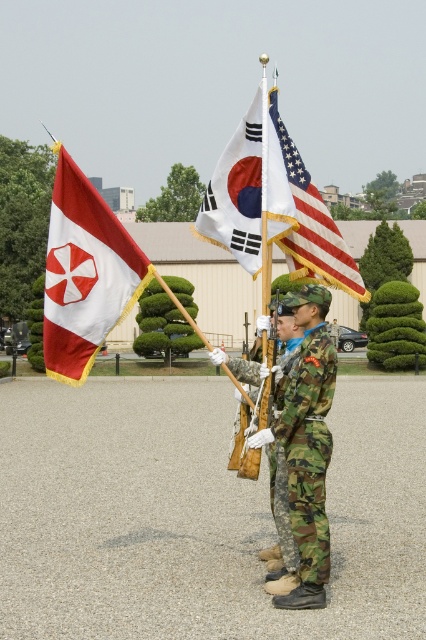
Question: Can you confirm if camouflage fabric uniform at center is bigger than american flag at center?

Choices:
 (A) no
 (B) yes

Answer: (A)

Question: Estimate the real-world distances between objects in this image. Which object is closer to the camo fabric uniform at center?

Choices:
 (A) white fabric flag at center
 (B) white matte flag at left
 (C) american flag at center

Answer: (C)

Question: Which object is positioned farthest from the white matte flag at left?

Choices:
 (A) american flag at center
 (B) white fabric flag at center

Answer: (A)

Question: Is american flag at center closer to camera compared to camo fabric uniform at center?

Choices:
 (A) no
 (B) yes

Answer: (A)

Question: Is white fabric flag at center closer to camera compared to american flag at center?

Choices:
 (A) no
 (B) yes

Answer: (A)

Question: Which point is closer to the camera?

Choices:
 (A) camouflage fabric uniform at center
 (B) camo fabric uniform at center

Answer: (A)